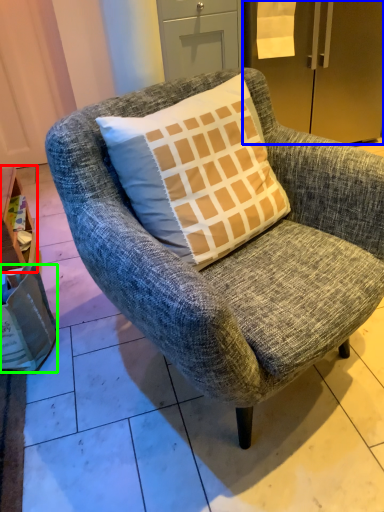
Question: Which object is positioned farthest from table (highlighted by a red box)? Select from refrigerator (highlighted by a blue box) and box (highlighted by a green box).

Choices:
 (A) refrigerator
 (B) box

Answer: (A)